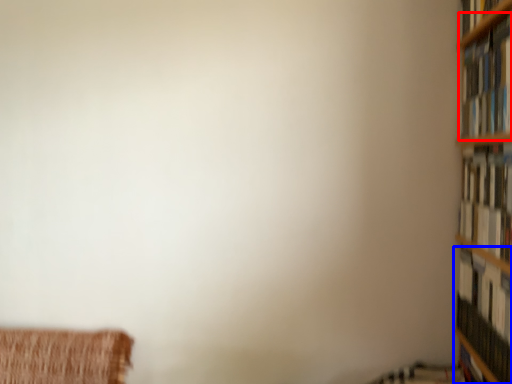
Question: Among these objects, which one is nearest to the camera, book (highlighted by a red box) or book (highlighted by a blue box)?

Choices:
 (A) book
 (B) book

Answer: (A)